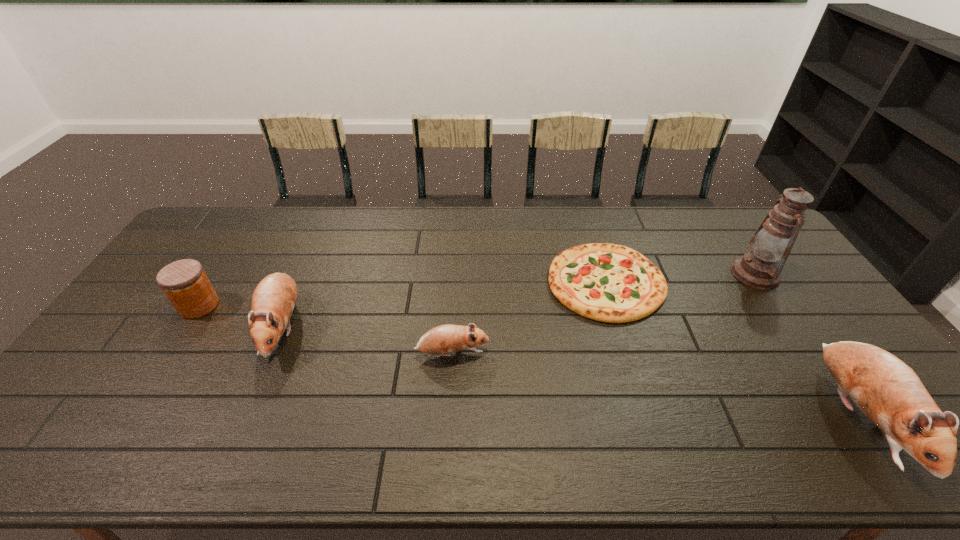
Locate an element on the screen. Image resolution: width=960 pixels, height=540 pixels. free space at the near edge is located at coordinates (256, 411).

Image resolution: width=960 pixels, height=540 pixels. In order to click on vacant space at the left edge in this screenshot , I will do `click(126, 386)`.

Image resolution: width=960 pixels, height=540 pixels. What are the coordinates of `vacant space at the right edge of the desktop` in the screenshot? It's located at (781, 275).

Where is `vacant region at the far left corner`? vacant region at the far left corner is located at coordinates 204,224.

Locate an element on the screen. The height and width of the screenshot is (540, 960). vacant space at the far right corner of the desktop is located at coordinates (735, 216).

I want to click on vacant space that's between the tallest object and the pizza, so click(x=681, y=278).

Where is `vacant region between the pizza and the rightmost hamster`? vacant region between the pizza and the rightmost hamster is located at coordinates (732, 350).

Find the location of a particular element. Image resolution: width=960 pixels, height=540 pixels. vacant space that's between the rightmost hamster and the fifth object from right to left is located at coordinates (570, 372).

I want to click on unoccupied position between the rightmost hamster and the tallest object, so (806, 346).

At what (x,y) coordinates should I click in order to perform the action: click on free space between the third object from left to right and the second tallest hamster. Please return your answer as a coordinate pair (x, y). Image resolution: width=960 pixels, height=540 pixels. Looking at the image, I should click on (367, 340).